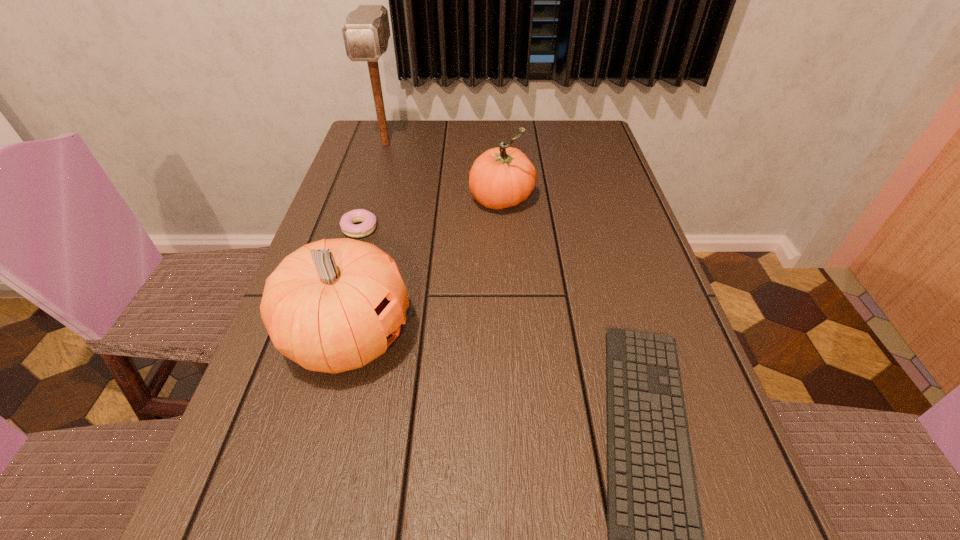
This screenshot has height=540, width=960. Find the location of `object that is at the far edge`. object that is at the far edge is located at coordinates [x=366, y=32].

Locate an element on the screen. mallet at the left edge is located at coordinates point(366,32).

The height and width of the screenshot is (540, 960). What are the coordinates of `pumpkin located at the left edge` in the screenshot? It's located at (334, 305).

Locate an element on the screen. This screenshot has width=960, height=540. doughnut present at the left edge is located at coordinates (347, 221).

I want to click on object at the far left corner, so pyautogui.click(x=366, y=32).

Where is `free point at the far edge`? free point at the far edge is located at coordinates (538, 145).

The height and width of the screenshot is (540, 960). What are the coordinates of `vacant region at the left edge` in the screenshot? It's located at (339, 200).

You are a GUI agent. You are given a task and a screenshot of the screen. Output one action in this format:
    pyautogui.click(x=<x>, y=<y>)
    Task: Click on the free region at the right edge of the desktop
    
    Given the screenshot: What is the action you would take?
    pyautogui.click(x=577, y=213)

Find the location of `vacant space at the far left corner of the desktop`. vacant space at the far left corner of the desktop is located at coordinates (399, 135).

Where is `unoccupied position between the nearer pumpkin and the second object from right to left`? This screenshot has width=960, height=540. unoccupied position between the nearer pumpkin and the second object from right to left is located at coordinates (425, 269).